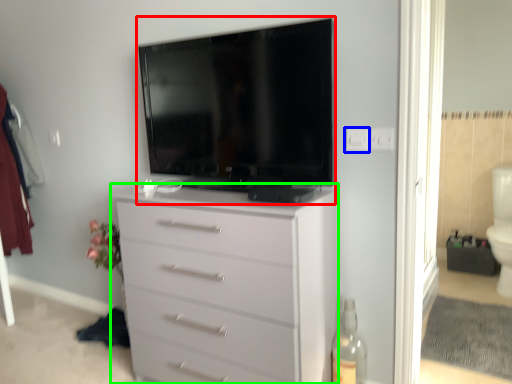
Question: Considering the real-world distances, which object is farthest from television (highlighted by a red box)? electric outlet (highlighted by a blue box) or chest of drawers (highlighted by a green box)?

Choices:
 (A) electric outlet
 (B) chest of drawers

Answer: (A)